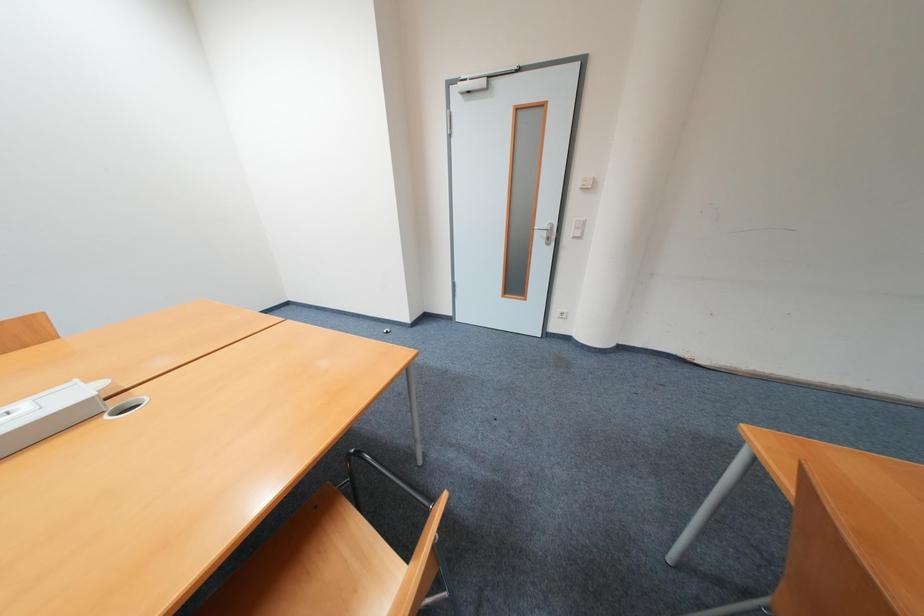
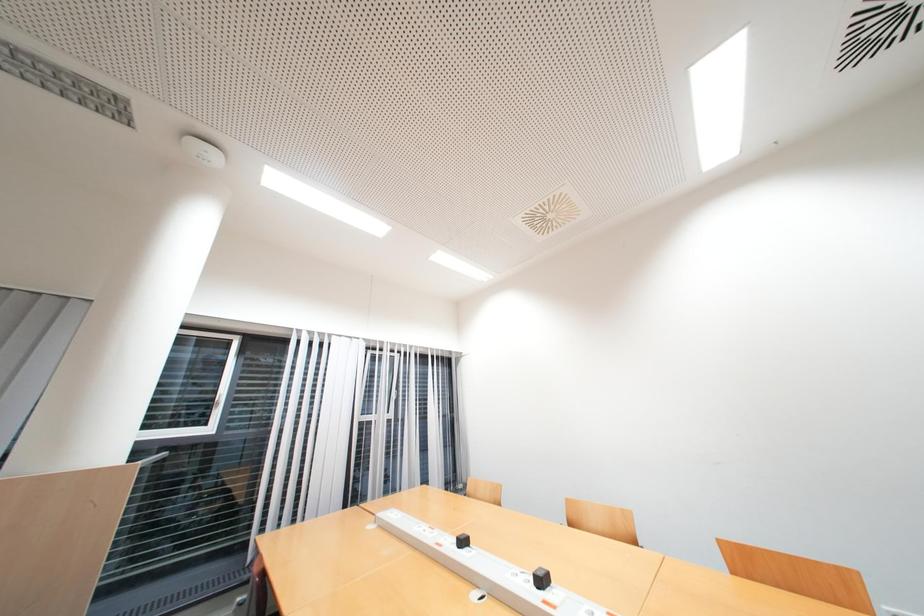
Question: How did the camera likely rotate?

Choices:
 (A) Left
 (B) Right
 (C) Up
 (D) Down

Answer: (A)